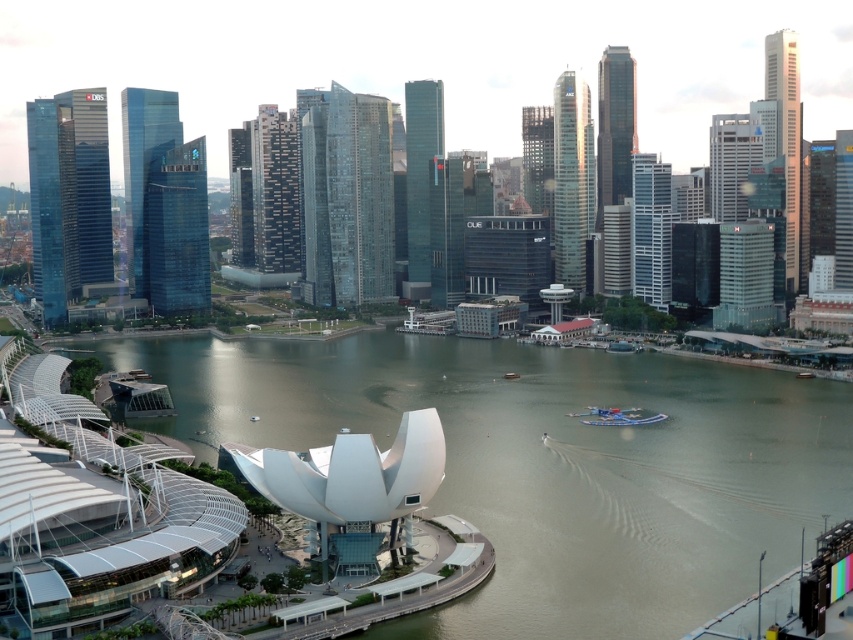
Question: In this image, where is greenish-gray water at center located relative to metallic blue boat at center?

Choices:
 (A) below
 (B) above

Answer: (B)

Question: Can you confirm if greenish-gray water at center is thinner than metallic blue boat at center?

Choices:
 (A) yes
 (B) no

Answer: (B)

Question: Which point is farther to the camera?

Choices:
 (A) [631, 364]
 (B) [607, 416]

Answer: (A)

Question: Does greenish-gray water at center have a larger size compared to metallic blue boat at center?

Choices:
 (A) no
 (B) yes

Answer: (B)